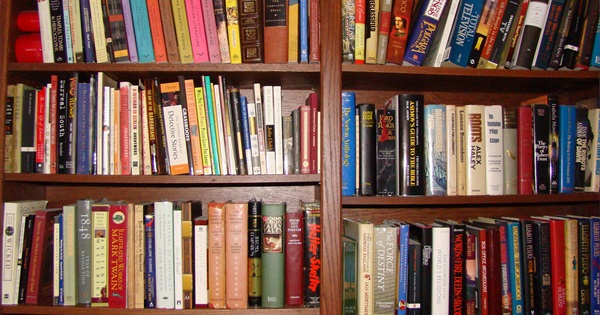
The image size is (600, 315). What are the coordinates of `book shelfs` in the screenshot? It's located at (195, 183), (237, 72), (442, 63), (486, 195), (156, 312).